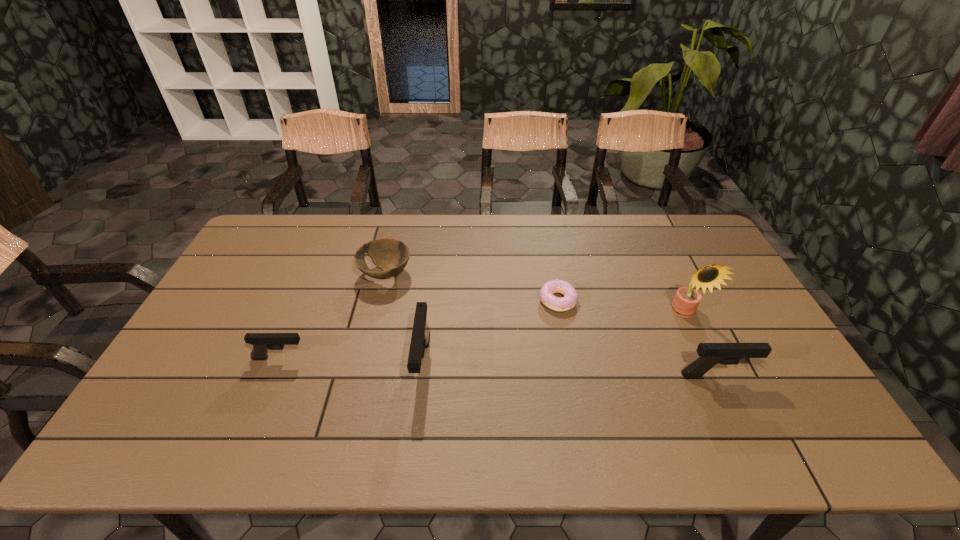
Find the location of a particular element. The height and width of the screenshot is (540, 960). free space located 0.280m on the front-facing side of the leftmost object is located at coordinates (411, 358).

What are the coordinates of `free space located on the front-facing side of the rightmost pistol` in the screenshot? It's located at (795, 375).

In order to click on free space located on the face of the sunflower in this screenshot , I will do `click(697, 339)`.

Find the location of a particular element. The width and height of the screenshot is (960, 540). free region located on the front of the fifth object from right to left is located at coordinates (378, 307).

Locate an element on the screen. The image size is (960, 540). vacant area situated on the front of the fourth object from left to right is located at coordinates (576, 400).

Locate an element on the screen. The width and height of the screenshot is (960, 540). object that is at the near edge is located at coordinates (420, 337).

I want to click on pistol at the right edge, so click(710, 354).

Locate an element on the screen. The image size is (960, 540). sunflower that is positioned at the right edge is located at coordinates pyautogui.click(x=685, y=303).

Identify the location of free space at the far edge of the desktop. This screenshot has height=540, width=960. tap(614, 254).

The height and width of the screenshot is (540, 960). In the image, there is a desktop. Identify the location of vacant region at the near edge. pyautogui.click(x=244, y=388).